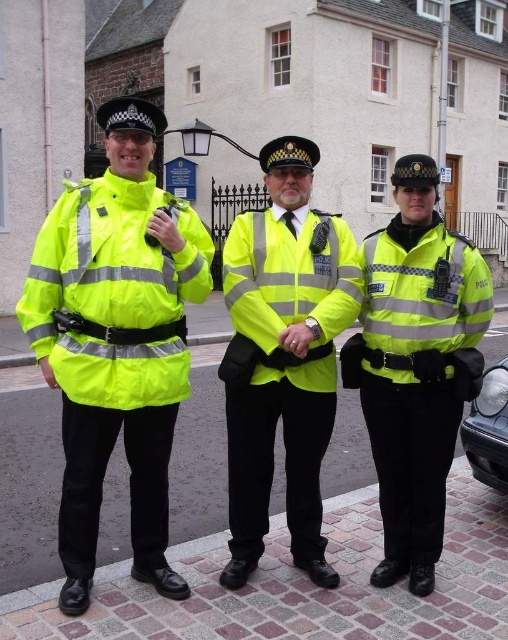
Question: Which object is positioned closest to the high visibility yellow fabric jacket at center?

Choices:
 (A) neon yellow reflective jacket at left
 (B) neon yellow reflective jacket at center

Answer: (B)

Question: Which of these objects is positioned farthest from the high visibility yellow fabric jacket at center?

Choices:
 (A) neon yellow reflective jacket at left
 (B) neon yellow reflective jacket at center

Answer: (A)

Question: Where is neon yellow reflective jacket at center located in relation to high visibility yellow fabric jacket at center in the image?

Choices:
 (A) below
 (B) above

Answer: (B)

Question: In this image, where is neon yellow reflective jacket at left located relative to neon yellow reflective jacket at center?

Choices:
 (A) left
 (B) right

Answer: (A)

Question: Is neon yellow reflective jacket at left above neon yellow reflective jacket at center?

Choices:
 (A) no
 (B) yes

Answer: (B)

Question: Among these objects, which one is nearest to the camera?

Choices:
 (A) neon yellow reflective jacket at center
 (B) neon yellow reflective jacket at left
 (C) high visibility yellow fabric jacket at center

Answer: (B)